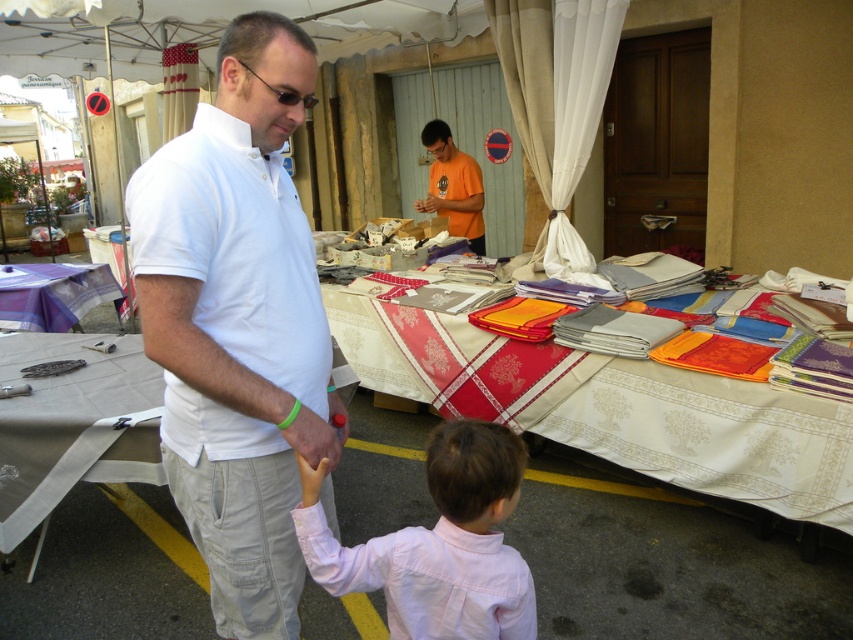
You are standing in the market and want to know which of the two points, point (285, 561) or point (15, 368), is closer to you. Can you determine this based on their positions?

Point (285, 561) is closer to the viewer than point (15, 368).

You are a customer at the market and want to buy the white cotton shirt at center. To reach it, you need to walk around the white fabric table at left. Which direction should you move relative to the table?

The white cotton shirt at center is located above the white fabric table at left, so you should move forward towards the table to reach it.